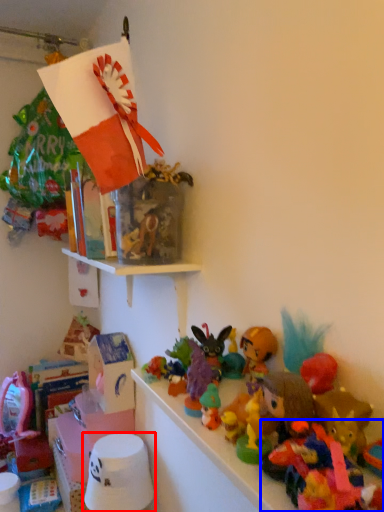
Question: Which object appears farthest to the camera in this image, toy (highlighted by a red box) or toy (highlighted by a blue box)?

Choices:
 (A) toy
 (B) toy

Answer: (A)